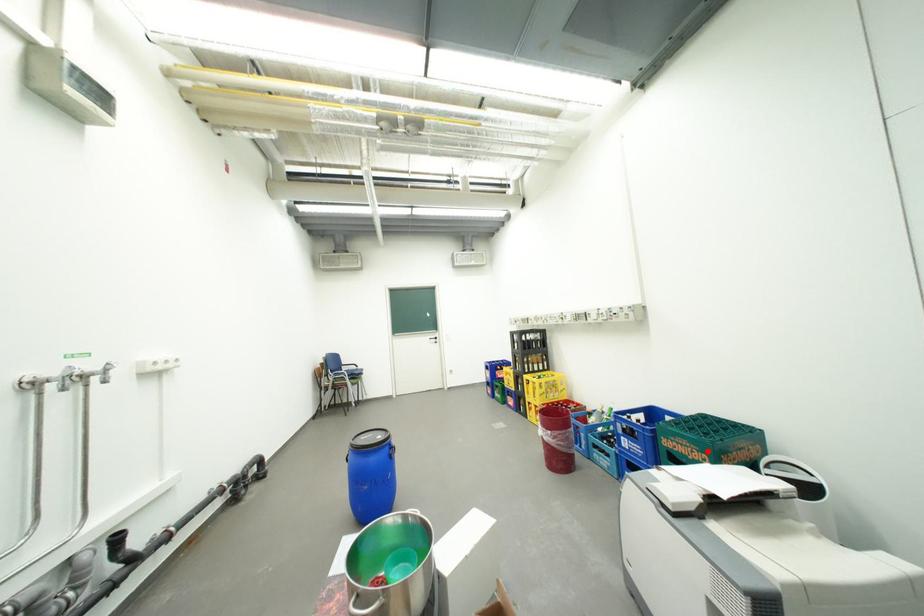
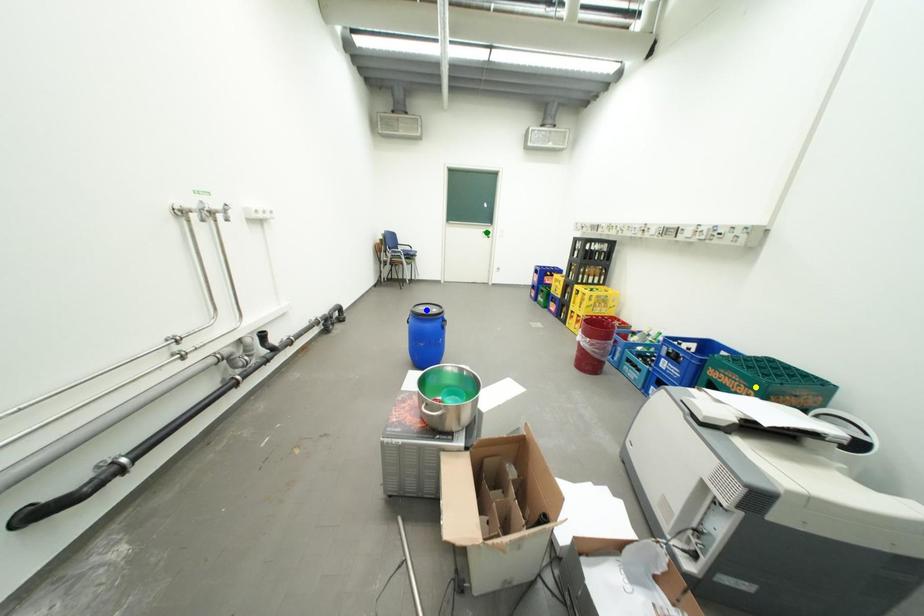
Question: I am providing you with two images of the same scene from different viewpoints. A red point is marked on the first image. You are given multiple points on the second image. Can you choose the point in image 2 that corresponds to the point in image 1?

Choices:
 (A) yellow point
 (B) blue point
 (C) green point

Answer: (A)